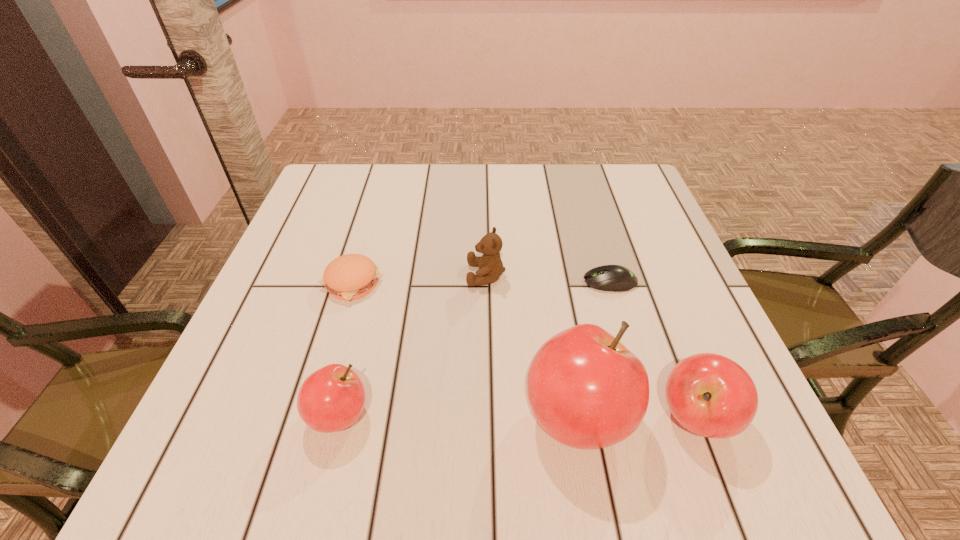
Where is `free location that satisfies the following two spatial constraints: 1. on the wheel side of the computer mouse; 2. on the front side of the second shortest object`? free location that satisfies the following two spatial constraints: 1. on the wheel side of the computer mouse; 2. on the front side of the second shortest object is located at coordinates (611, 284).

Where is `free point that satisfies the following two spatial constraints: 1. on the front side of the fifth tallest object; 2. on the right side of the rightmost apple`? free point that satisfies the following two spatial constraints: 1. on the front side of the fifth tallest object; 2. on the right side of the rightmost apple is located at coordinates (312, 417).